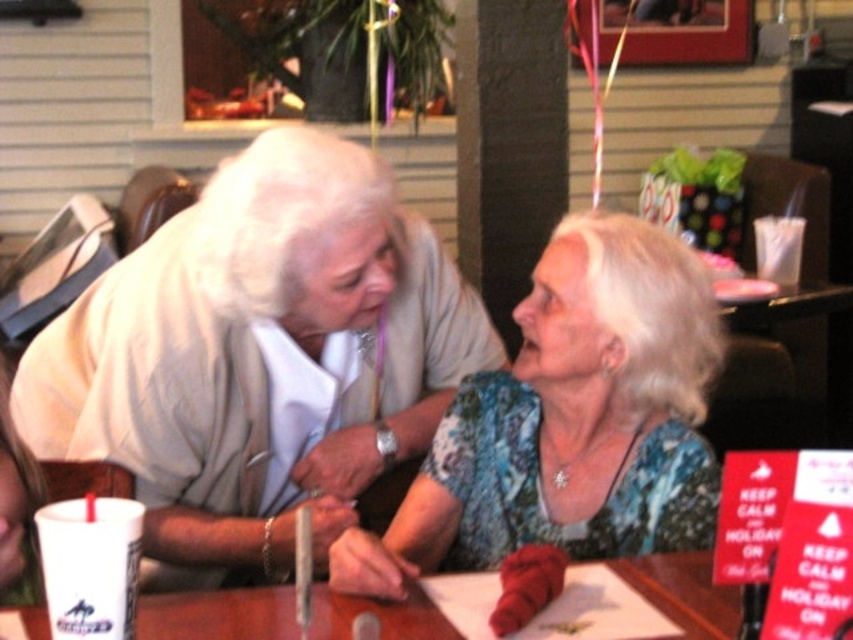
You are a delivery person who needs to place a small package on the brown wooden table at center without disturbing the matte white blouse at center. Can you fit the package between them if the package is 17 inches long?

The matte white blouse at center and brown wooden table at center are 16.95 inches apart. Since the package is 17 inches long, it cannot fit between them as the space is slightly smaller than the package.

Based on the photo, you are an architect designing a new dining space and need to ensure that two important decorative elements placed at the coordinates of point (x=633, y=465) and point (x=671, y=580) will be visible to guests sitting at the table. Which point is closer to the guests so they can see it better?

Point (x=633, y=465) is closer to the guests because it is further to the viewer than point (x=671, y=580), making it more visible from their seating position.